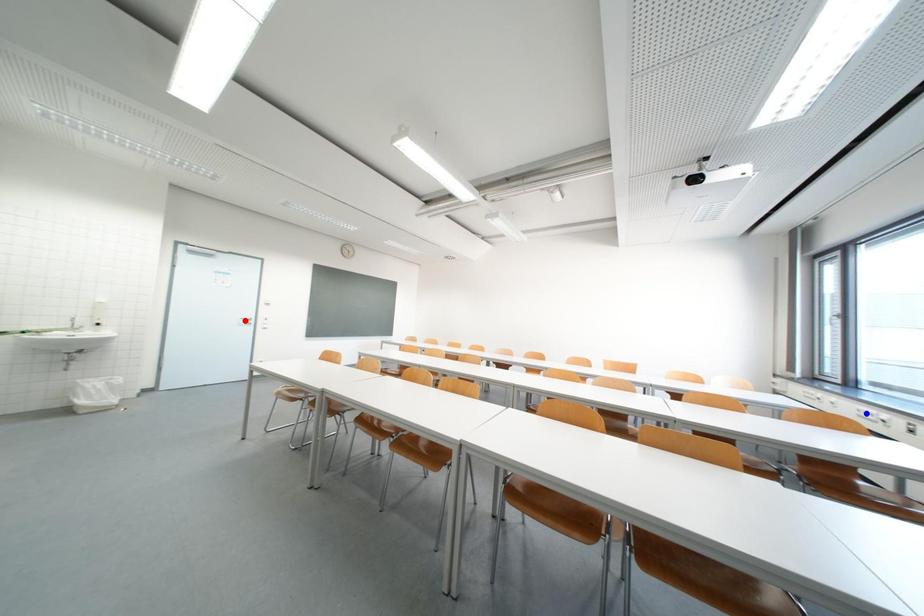
Question: In the image, two points are highlighted. Which point is nearer to the camera? Reply with the corresponding letter.

Choices:
 (A) blue point
 (B) red point

Answer: (A)